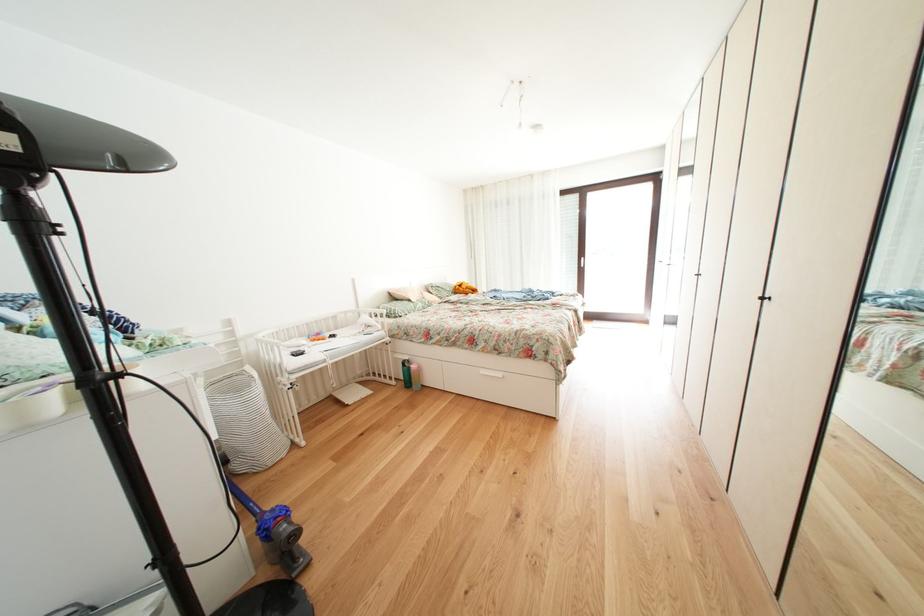
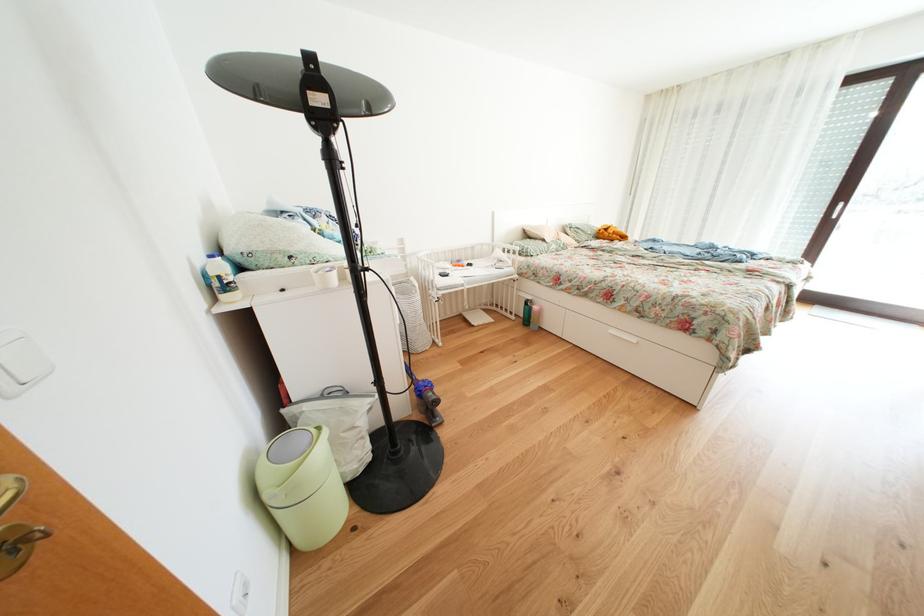
In the second image, find the point that corresponds to (x=418, y=367) in the first image.

(541, 307)